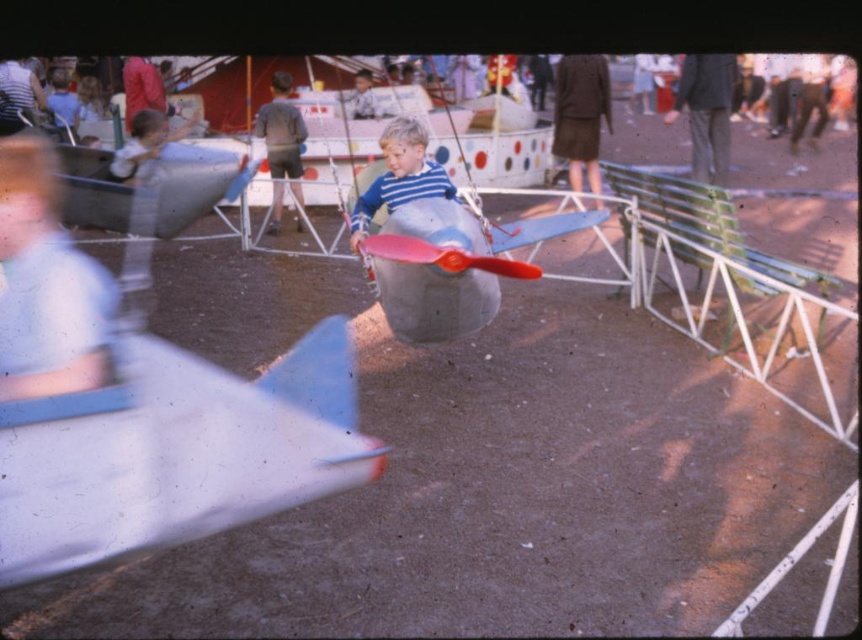
You are at the fairground and want to locate the metallic silver airplane at center. According to the coordinates provided, where exactly is it positioned?

The metallic silver airplane at center is positioned at coordinates point (x=438, y=243).

You are a parent at the fairground looking for your child. You see two airplanes at the center. Which airplane is closer to the ground, the metallic silver airplane at center or the matte plastic toy airplane at center?

The metallic silver airplane at center is positioned under the matte plastic toy airplane at center, so the metallic silver airplane at center is closer to the ground.